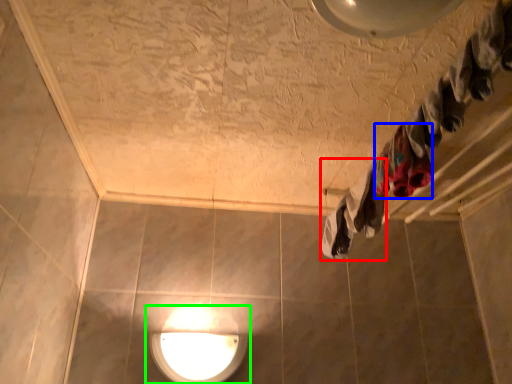
Question: Which is farther away from clothing (highlighted by a red box)? clothing (highlighted by a blue box) or lamp (highlighted by a green box)?

Choices:
 (A) clothing
 (B) lamp

Answer: (B)